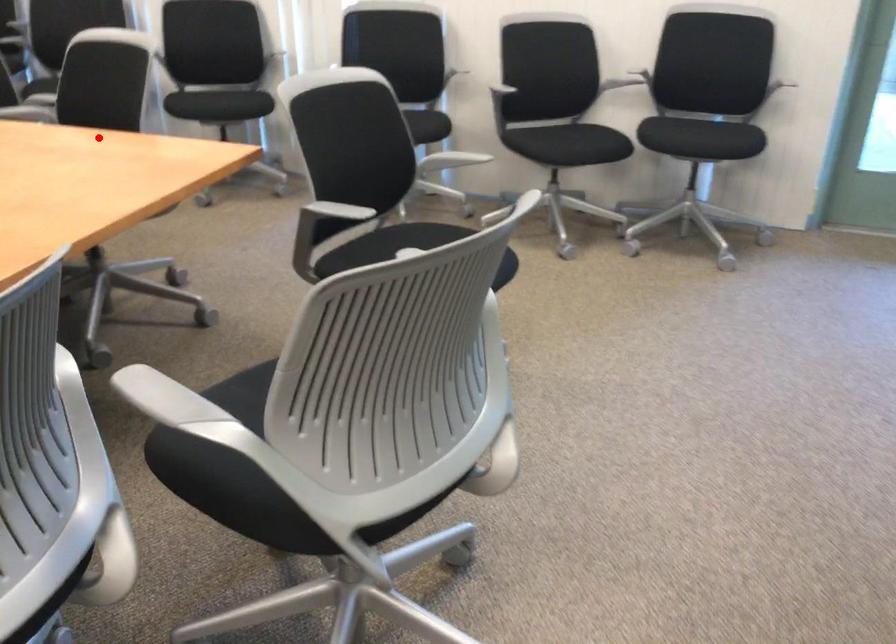
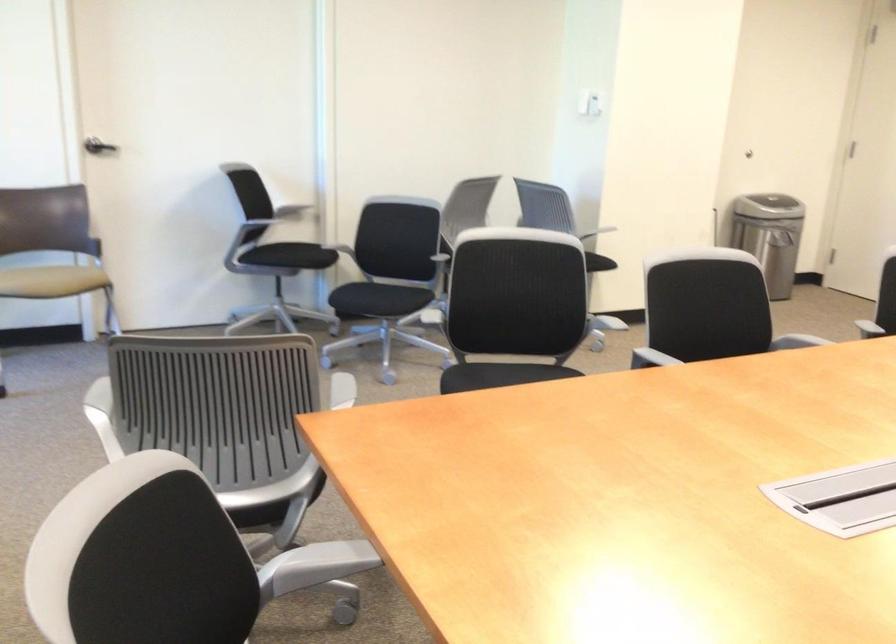
The point at the highlighted location is marked in the first image. Where is the corresponding point in the second image?

(320, 562)